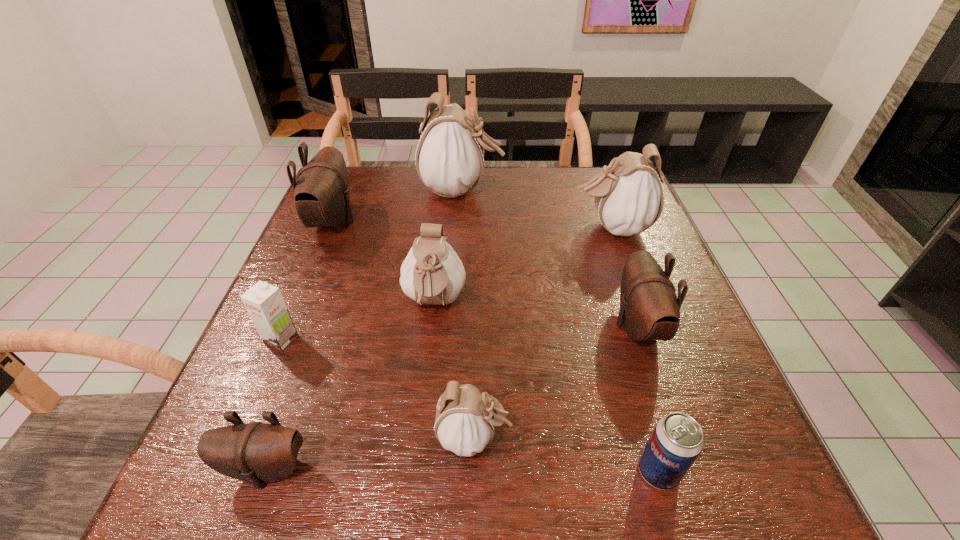
Locate an element on the screen. free point between the second farthest brown pouch and the chocolate milk is located at coordinates (460, 333).

The width and height of the screenshot is (960, 540). Identify the location of empty space that is in between the biggest brown pouch and the smallest white pouch. (403, 329).

Identify the location of unoccupied position between the smallest brown pouch and the smallest white pouch. (371, 453).

Find the location of a particular element. This screenshot has width=960, height=540. free space between the biggest white pouch and the farthest brown pouch is located at coordinates (397, 206).

What are the coordinates of `free point between the red beer can and the biggest brown pouch` in the screenshot? It's located at (495, 347).

Locate which object is the seventh closest to the farthest brown pouch. Please provide its 2D coordinates. Your answer should be formatted as a tuple, i.e. [(x, y)], where the tuple contains the x and y coordinates of a point satisfying the conditions above.

[(649, 309)]

Identify which object is the second nearest to the smallest brown pouch. Please provide its 2D coordinates. Your answer should be formatted as a tuple, i.e. [(x, y)], where the tuple contains the x and y coordinates of a point satisfying the conditions above.

[(464, 423)]

The image size is (960, 540). What are the coordinates of `pouch that can be found as the fifth closest to the second biggest brown pouch` in the screenshot? It's located at (256, 452).

What are the coordinates of `pouch object that ranks as the second closest to the beer can` in the screenshot? It's located at (464, 423).

Where is `white pouch that stands as the third closest to the brown chocolate milk`? Image resolution: width=960 pixels, height=540 pixels. white pouch that stands as the third closest to the brown chocolate milk is located at coordinates (449, 157).